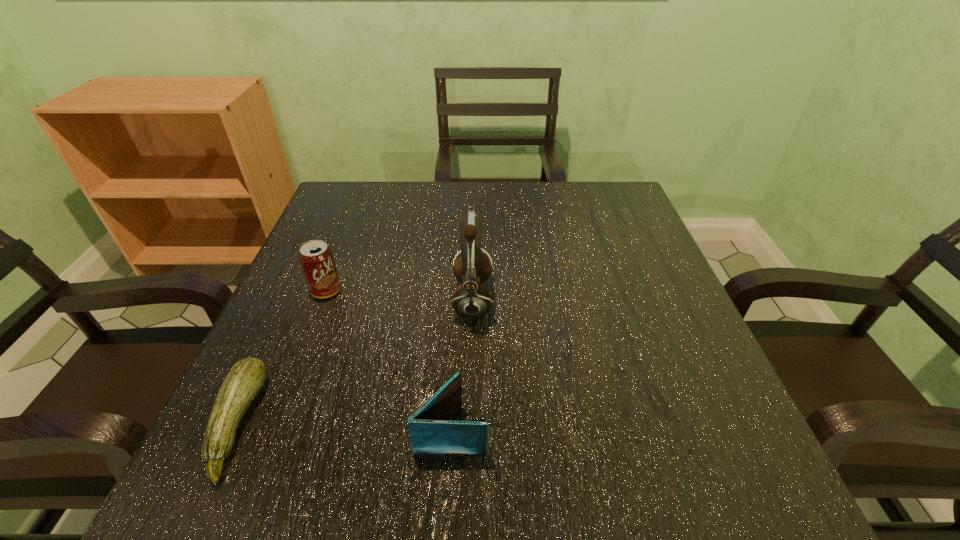
Locate an element on the screen. The width and height of the screenshot is (960, 540). empty space between the third tallest object and the earphone is located at coordinates (462, 365).

Identify the location of vacant area that lies between the earphone and the wallet. (462, 365).

Locate an element on the screen. Image resolution: width=960 pixels, height=540 pixels. object that is the closest to the wallet is located at coordinates (471, 300).

Identify which object is located as the second nearest to the leftmost object. Please provide its 2D coordinates. Your answer should be formatted as a tuple, i.e. [(x, y)], where the tuple contains the x and y coordinates of a point satisfying the conditions above.

[(432, 434)]

The width and height of the screenshot is (960, 540). Identify the location of vacant space that satisfies the following two spatial constraints: 1. on the front side of the third object from right to left; 2. at the stem end of the leftmost object. (276, 423).